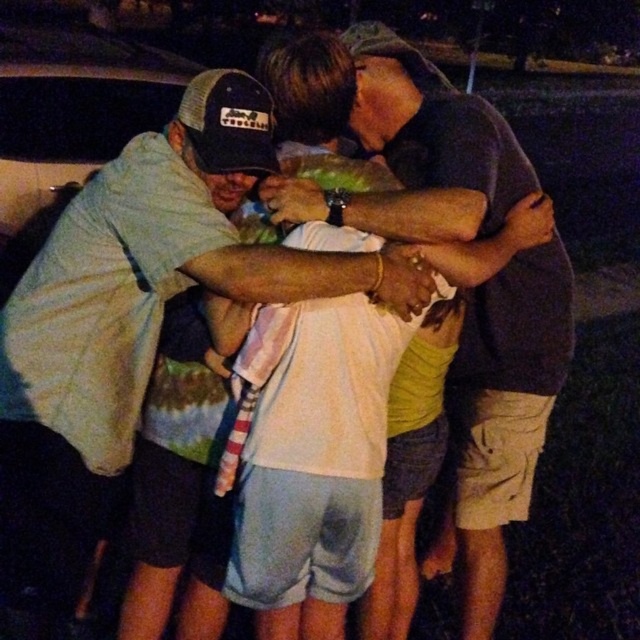
Question: Does light blue shirt at center appear under dark gray shirt at center?

Choices:
 (A) yes
 (B) no

Answer: (A)

Question: Which of the following is the closest to the observer?

Choices:
 (A) (244, 163)
 (B) (424, 60)

Answer: (A)

Question: Is light blue shirt at center closer to the viewer compared to dark gray shirt at center?

Choices:
 (A) yes
 (B) no

Answer: (A)

Question: Is light blue shirt at center positioned in front of dark gray shirt at center?

Choices:
 (A) yes
 (B) no

Answer: (A)